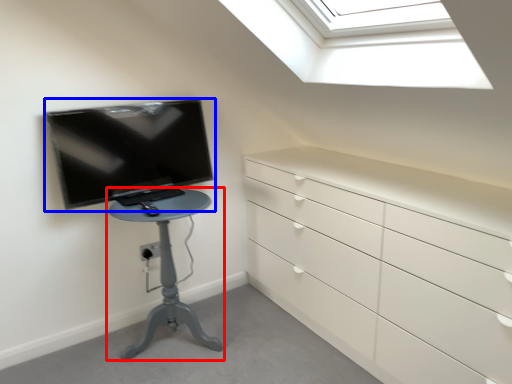
Question: Which of the following is the closest to the observer, furniture (highlighted by a red box) or television (highlighted by a blue box)?

Choices:
 (A) furniture
 (B) television

Answer: (A)